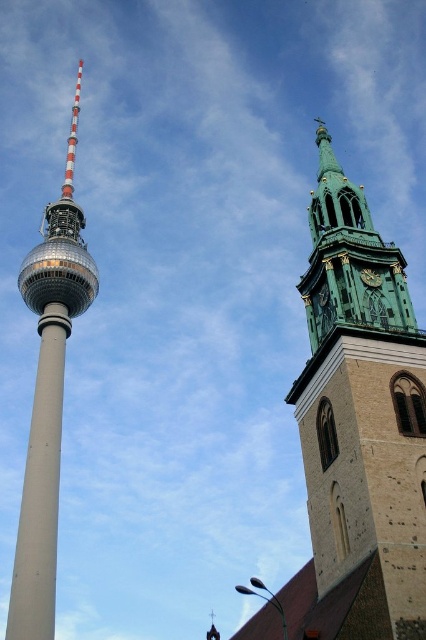
Is smooth gray pole at left below dark green stone clock at upper right?

Indeed, smooth gray pole at left is positioned under dark green stone clock at upper right.

Does point (51, 403) come in front of point (365, 284)?

No, (51, 403) is further to viewer.

You are a GUI agent. You are given a task and a screenshot of the screen. Output one action in this format:
    pyautogui.click(x=<x>, y=<y>)
    Task: Click on the smooth gray pole at left
    The image size is (426, 640).
    Given the screenshot: What is the action you would take?
    pyautogui.click(x=40, y=490)

Is the position of green patina steeple at right more distant than that of dark green stone clock at upper right?

No, green patina steeple at right is closer to the viewer.

Identify the location of green patina steeple at right. (362, 404).

This screenshot has width=426, height=640. I want to click on green patina steeple at right, so click(x=362, y=404).

Which is behind, point (313, 250) or point (43, 496)?

Point (43, 496)

Between point (391, 422) and point (40, 348), which one is positioned behind?

Positioned behind is point (40, 348).

In order to click on green patina steeple at right in this screenshot , I will do [x=362, y=404].